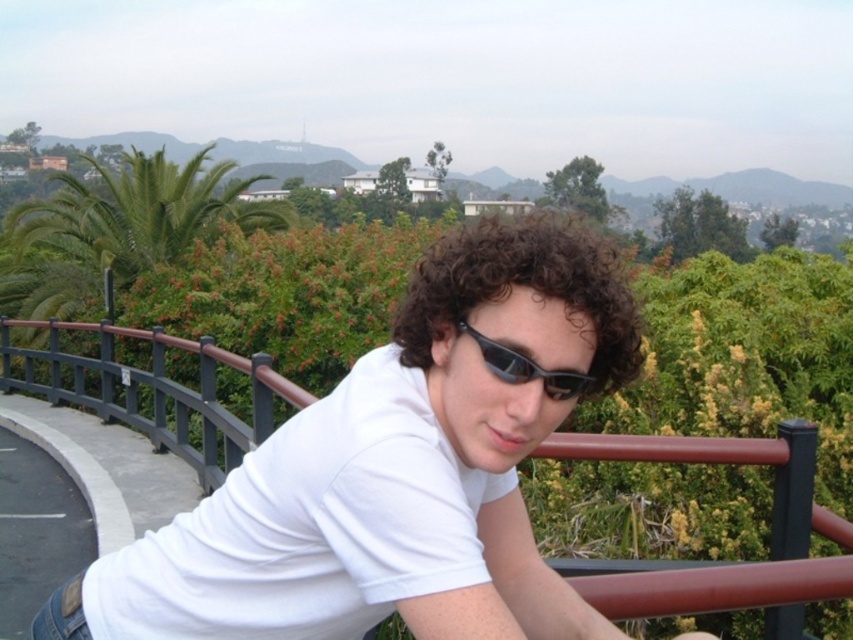
You are standing at the point marked by the coordinates point (x=393, y=472) in the image. What object are you directly facing?

The point (x=393, y=472) indicates the white matte shirt at center, so you are directly facing the white matte shirt at center.

You are a photographer trying to capture a closeup of the curly brown hair at center and the black plastic goggles at center. Which object should you zoom in on to ensure both fit in the frame without cropping?

Since the curly brown hair at center is wider than the black plastic goggles at center, you should zoom in on the black plastic goggles at center to ensure both fit in the frame without cropping.

You are a photographer standing at the scene and want to take a portrait of the person with both curly brown hair at center and black plastic goggles at center in focus. Given that your camera has a depth of field that can cover 35 inches, will both objects be in focus?

The curly brown hair at center is 37.03 inches away from the black plastic goggles at center. Since the distance between them exceeds the camera depth of field of 35 inches, the photographer cannot have both in focus at the same time.